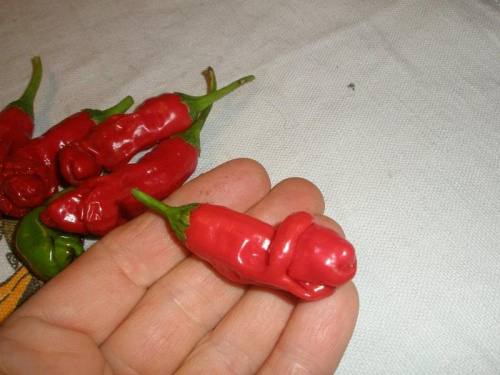
Image resolution: width=500 pixels, height=375 pixels. In order to click on bed in this screenshot , I will do `click(436, 66)`.